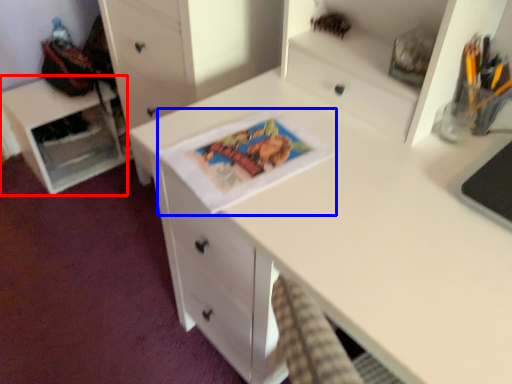
Question: Which point is further to the camera, cabinetry (highlighted by a red box) or comic book (highlighted by a blue box)?

Choices:
 (A) cabinetry
 (B) comic book

Answer: (A)